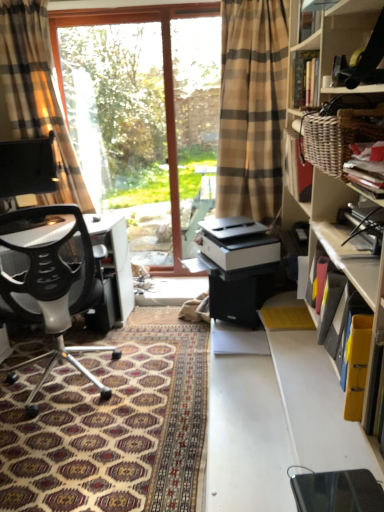
Question: Considering the relative sizes of transparent glass window at center and transparent glass screen door at center in the image provided, is transparent glass window at center bigger than transparent glass screen door at center?

Choices:
 (A) no
 (B) yes

Answer: (B)

Question: From a real-world perspective, is transparent glass window at center over transparent glass screen door at center?

Choices:
 (A) yes
 (B) no

Answer: (B)

Question: Is transparent glass window at center oriented away from transparent glass screen door at center?

Choices:
 (A) no
 (B) yes

Answer: (A)

Question: Does transparent glass window at center have a lesser width compared to transparent glass screen door at center?

Choices:
 (A) yes
 (B) no

Answer: (A)

Question: Can you confirm if transparent glass window at center is positioned to the right of transparent glass screen door at center?

Choices:
 (A) yes
 (B) no

Answer: (B)

Question: Is transparent glass window at center positioned beyond the bounds of transparent glass screen door at center?

Choices:
 (A) yes
 (B) no

Answer: (A)

Question: Considering the relative positions of yellow paper at upper right, which is the third book from bottom to top, and matte black book at upper right, which is counted as the 2th book, starting from the bottom, in the image provided, is yellow paper at upper right, which is the third book from bottom to top, to the left of matte black book at upper right, which is counted as the 2th book, starting from the bottom, from the viewer's perspective?

Choices:
 (A) no
 (B) yes

Answer: (B)

Question: From a real-world perspective, is yellow paper at upper right, which is the third book from bottom to top, over matte black book at upper right, the 2th book when ordered from top to bottom?

Choices:
 (A) yes
 (B) no

Answer: (A)

Question: Is yellow paper at upper right, the 1th book when ordered from top to bottom, touching matte black book at upper right, which is counted as the 2th book, starting from the bottom?

Choices:
 (A) yes
 (B) no

Answer: (B)

Question: Considering the relative sizes of yellow paper at upper right, which is the third book from bottom to top, and matte black book at upper right, which is counted as the 2th book, starting from the bottom, in the image provided, is yellow paper at upper right, which is the third book from bottom to top, shorter than matte black book at upper right, which is counted as the 2th book, starting from the bottom,?

Choices:
 (A) no
 (B) yes

Answer: (A)

Question: Is yellow paper at upper right, which is the third book from bottom to top, positioned far away from matte black book at upper right, the 2th book when ordered from top to bottom?

Choices:
 (A) yes
 (B) no

Answer: (B)

Question: Is matte black book at upper right, the 2th book when ordered from top to bottom, at the back of yellow paper at upper right, the 1th book when ordered from top to bottom?

Choices:
 (A) no
 (B) yes

Answer: (A)

Question: Does patterned carpet at lower left have a smaller size compared to plaid fabric curtain at left?

Choices:
 (A) no
 (B) yes

Answer: (A)